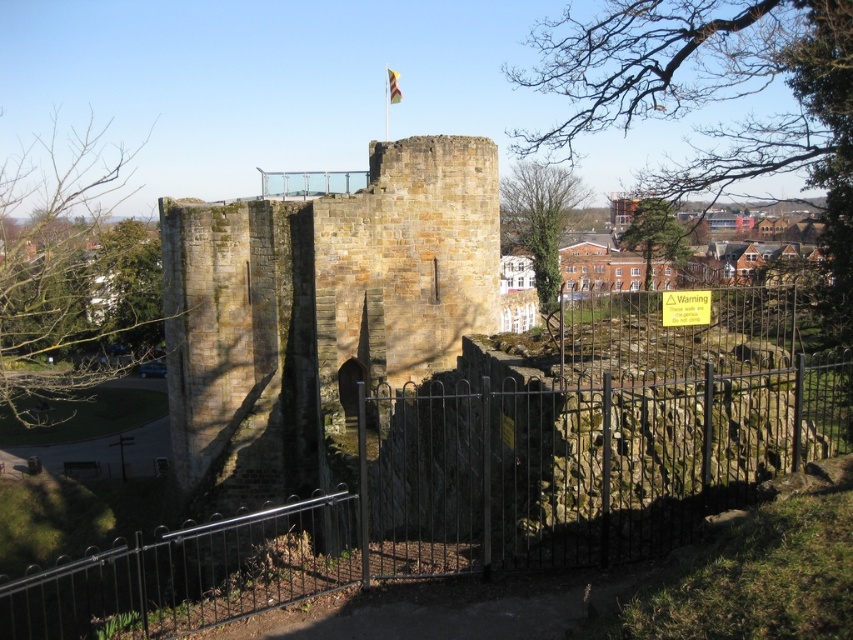
Is brown stone ruins at center to the right of yellow fabric flag at center from the viewer's perspective?

No, brown stone ruins at center is not to the right of yellow fabric flag at center.

What do you see at coordinates (318, 312) in the screenshot? I see `brown stone ruins at center` at bounding box center [318, 312].

In order to click on brown stone ruins at center in this screenshot , I will do `click(318, 312)`.

Consider the image. Between black wrought iron gate at center and yellow fabric flag at center, which one is positioned lower?

black wrought iron gate at center

Which of these two, black wrought iron gate at center or yellow fabric flag at center, stands taller?

Standing taller between the two is yellow fabric flag at center.

Which is in front, point (283, 579) or point (396, 74)?

Point (283, 579) is more forward.

Where is `black wrought iron gate at center`? The width and height of the screenshot is (853, 640). black wrought iron gate at center is located at coordinates pyautogui.click(x=463, y=497).

At what (x,y) coordinates should I click in order to perform the action: click on black wrought iron gate at center. Please return your answer as a coordinate pair (x, y). This screenshot has width=853, height=640. Looking at the image, I should click on (463, 497).

Is black wrought iron gate at center taller than brown stone ruins at center?

In fact, black wrought iron gate at center may be shorter than brown stone ruins at center.

You are a GUI agent. You are given a task and a screenshot of the screen. Output one action in this format:
    pyautogui.click(x=<x>, y=<y>)
    Task: Click on the black wrought iron gate at center
    This screenshot has height=640, width=853.
    Given the screenshot: What is the action you would take?
    pyautogui.click(x=463, y=497)

Identify the location of black wrought iron gate at center. The image size is (853, 640). (463, 497).